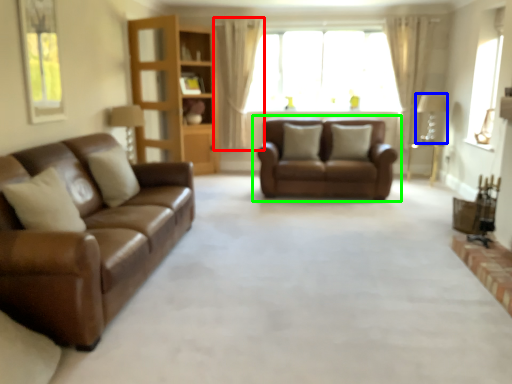
Question: Which is farther away from curtain (highlighted by a red box)? lamp (highlighted by a blue box) or studio couch (highlighted by a green box)?

Choices:
 (A) lamp
 (B) studio couch

Answer: (A)